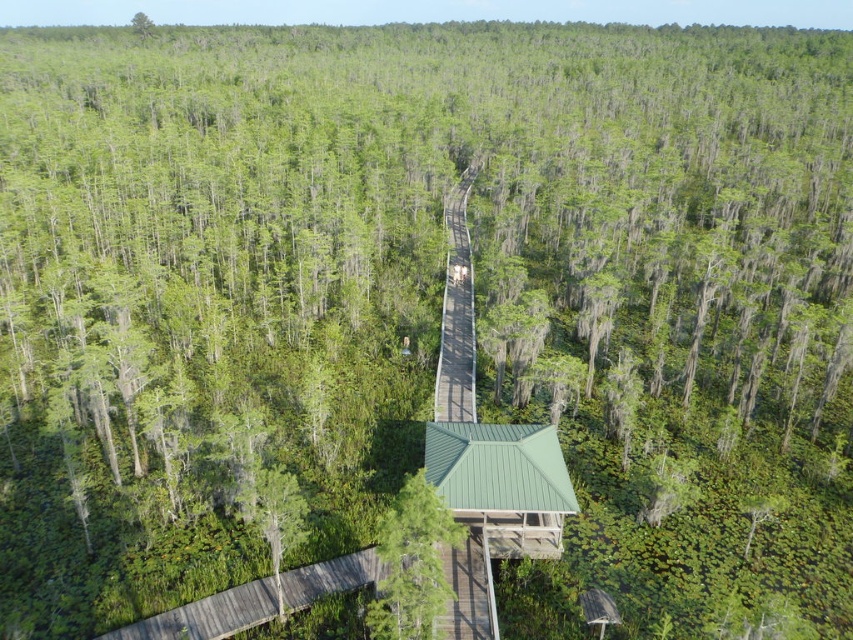
Question: Which point is closer to the camera?

Choices:
 (A) (412, 515)
 (B) (471, 269)
 (C) (273, 609)
 (D) (280, 621)

Answer: (A)

Question: Which object appears closest to the camera in this image?

Choices:
 (A) smooth gray wooden bridge at bottom left
 (B) green matte tree at lower left

Answer: (B)

Question: Observing the image, what is the correct spatial positioning of green matte tree at center in reference to smooth gray wooden bridge at bottom left?

Choices:
 (A) above
 (B) below

Answer: (A)

Question: Does smooth gray wooden bridge at bottom left appear under brown wooden boardwalk at center?

Choices:
 (A) yes
 (B) no

Answer: (A)

Question: Which point is closer to the camera taking this photo?

Choices:
 (A) (204, 636)
 (B) (471, 384)
 (C) (306, 531)
 (D) (427, 548)

Answer: (D)

Question: Can you confirm if green matte tree at center is smaller than brown wooden boardwalk at center?

Choices:
 (A) no
 (B) yes

Answer: (B)